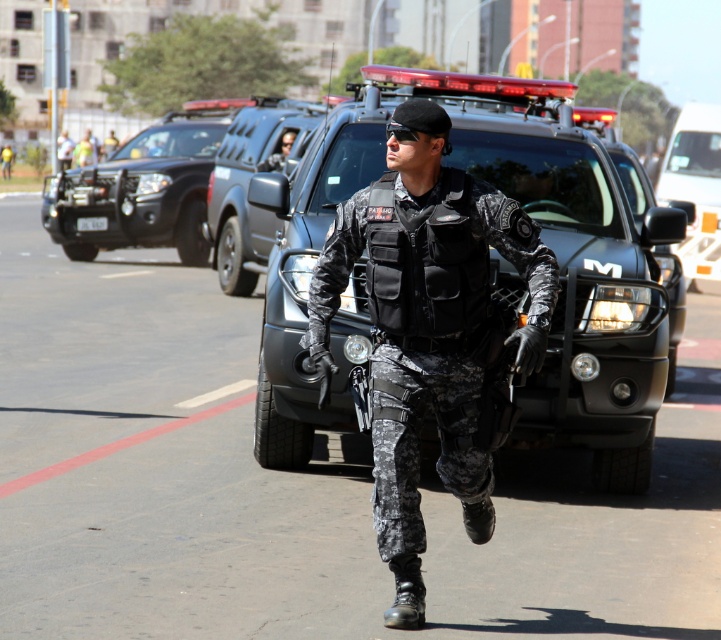
Is black matte jeep at center positioned at the back of glossy black jeep at center?

No, it is not.

Who is shorter, black matte jeep at center or glossy black jeep at center?

Standing shorter between the two is glossy black jeep at center.

Is point (640, 285) positioned in front of point (221, 232)?

Yes, point (640, 285) is in front of point (221, 232).

Identify the location of black matte jeep at center. (531, 227).

Is black matte jeep at center to the left of matte black helmet at upper center from the viewer's perspective?

Incorrect, black matte jeep at center is not on the left side of matte black helmet at upper center.

Who is more forward, (x=614, y=328) or (x=278, y=157)?

Point (x=614, y=328)

This screenshot has height=640, width=721. I want to click on black matte jeep at center, so click(531, 227).

Is the position of camouflage fabric uniform at center more distant than that of black matte jeep at upper left?

That is False.

Who is higher up, camouflage fabric uniform at center or black matte jeep at upper left?

Positioned higher is black matte jeep at upper left.

Which is in front, point (386, 449) or point (110, 241)?

Point (386, 449) is more forward.

In order to click on camouflage fabric uniform at center in this screenshot , I will do `click(428, 326)`.